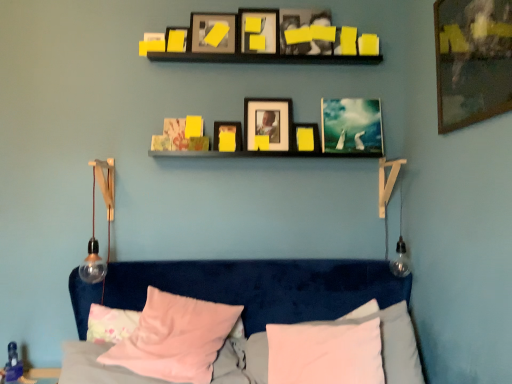
Question: Does matte yellow picture frame at center, which is counted as the 6th picture frame, starting from the front, have a greater height compared to pink fabric pillow at lower center, which appears as the second pillow when viewed from the left?

Choices:
 (A) yes
 (B) no

Answer: (B)

Question: From a real-world perspective, is matte yellow picture frame at center, the fourth picture frame from the back, located beneath pink fabric pillow at lower center, placed as the second pillow when sorted from right to left?

Choices:
 (A) no
 (B) yes

Answer: (A)

Question: Does matte yellow picture frame at center, which is counted as the 6th picture frame, starting from the front, appear on the right side of pink fabric pillow at lower center, which appears as the second pillow when viewed from the left?

Choices:
 (A) no
 (B) yes

Answer: (B)

Question: Is matte yellow picture frame at center, the fourth picture frame from the back, facing towards pink fabric pillow at lower center, which appears as the second pillow when viewed from the left?

Choices:
 (A) no
 (B) yes

Answer: (A)

Question: Is matte yellow picture frame at center, the fourth picture frame from the back, positioned behind pink fabric pillow at lower center, placed as the second pillow when sorted from right to left?

Choices:
 (A) yes
 (B) no

Answer: (A)

Question: Relative to matte black picture frame at center, positioned as the third picture frame in back-to-front order, is clear glass bulb at left in front or behind?

Choices:
 (A) front
 (B) behind

Answer: (A)

Question: Would you say clear glass bulb at left is to the left or to the right of matte black picture frame at center, positioned as the third picture frame in back-to-front order, in the picture?

Choices:
 (A) right
 (B) left

Answer: (B)

Question: From the image's perspective, is clear glass bulb at left located above or below matte black picture frame at center, positioned as the third picture frame in back-to-front order?

Choices:
 (A) below
 (B) above

Answer: (A)

Question: From a real-world perspective, is clear glass bulb at left physically located above or below matte black picture frame at center, positioned as the third picture frame in back-to-front order?

Choices:
 (A) below
 (B) above

Answer: (A)

Question: In the image, is pink soft pillow at lower center, positioned as the first pillow in right-to-left order, positioned in front of or behind matte black picture frame at upper left, the 8th picture frame positioned from the back?

Choices:
 (A) behind
 (B) front

Answer: (B)

Question: From the image's perspective, is pink soft pillow at lower center, positioned as the first pillow in right-to-left order, above or below matte black picture frame at upper left, the 8th picture frame positioned from the back?

Choices:
 (A) above
 (B) below

Answer: (B)

Question: From a real-world perspective, is pink soft pillow at lower center, acting as the third pillow starting from the left, above or below matte black picture frame at upper left, the 8th picture frame positioned from the back?

Choices:
 (A) above
 (B) below

Answer: (B)

Question: Is pink soft pillow at lower center, acting as the third pillow starting from the left, bigger or smaller than matte black picture frame at upper left, the 8th picture frame positioned from the back?

Choices:
 (A) big
 (B) small

Answer: (A)

Question: Visually, is matte black picture frame at center, which is the seventh picture frame from front to back, positioned to the left or to the right of pink fabric pillow at lower center, placed as the second pillow when sorted from right to left?

Choices:
 (A) right
 (B) left

Answer: (A)

Question: Is matte black picture frame at center, which is the seventh picture frame from front to back, situated inside pink fabric pillow at lower center, placed as the second pillow when sorted from right to left, or outside?

Choices:
 (A) inside
 (B) outside

Answer: (B)